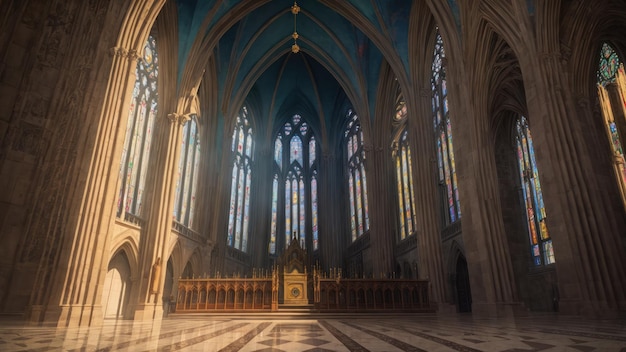
Identify the location of ceiling. (297, 287), (283, 35).